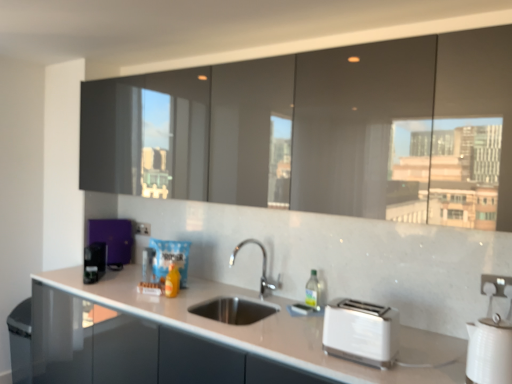
Identify the location of vacant area that is in front of white plastic toaster at lower right. This screenshot has height=384, width=512. (369, 374).